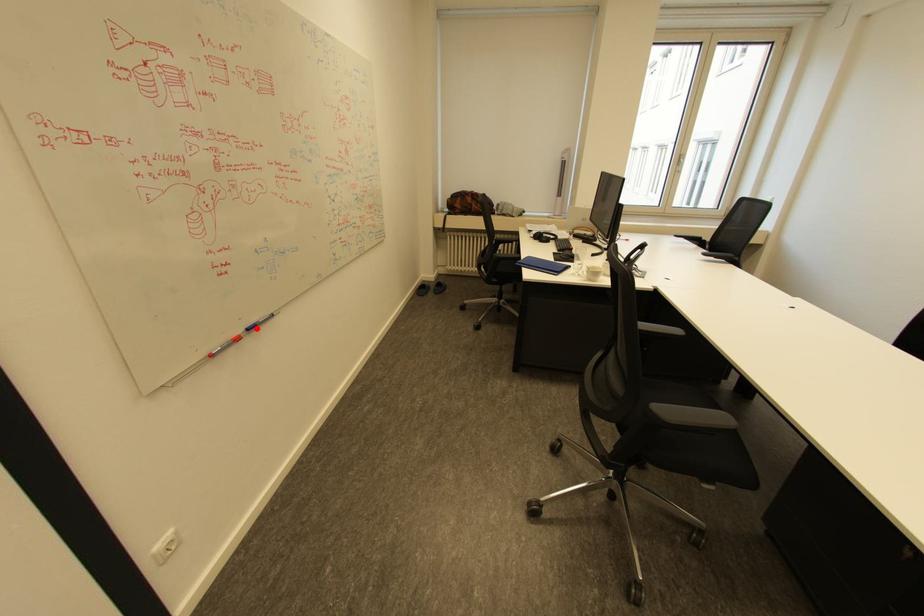
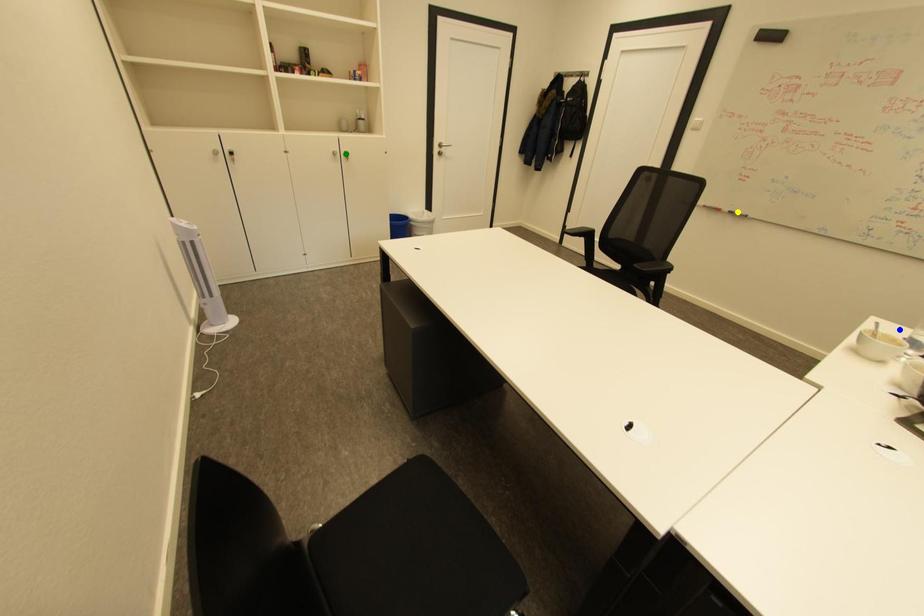
Question: I am providing you with two images of the same scene from different viewpoints. A red point is marked on the first image. You are given multiple points on the second image. Which spot in image 2 lines up with the point in image 1?

Choices:
 (A) yellow point
 (B) green point
 (C) blue point

Answer: (A)